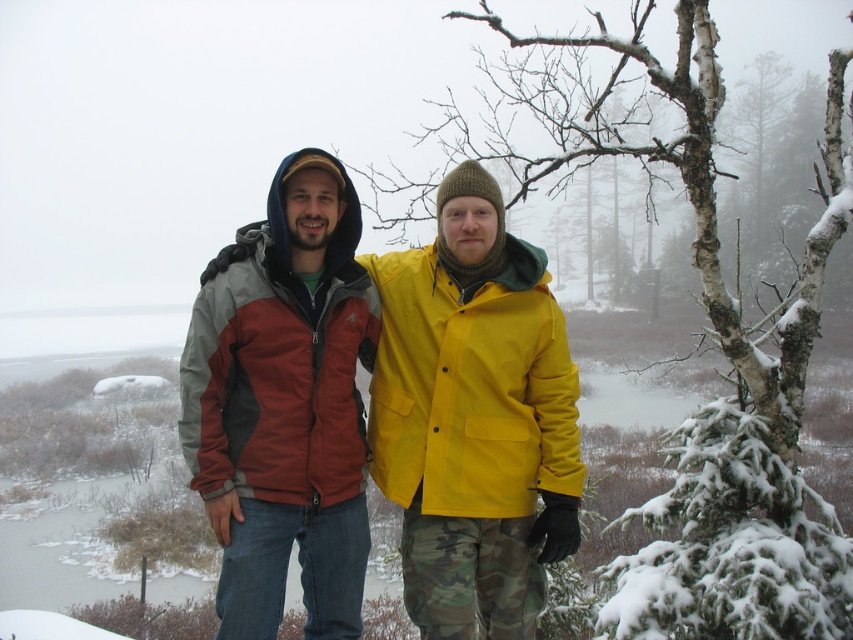
Question: Can you confirm if matte red jacket at center is positioned above matte nylon jacket at center?

Choices:
 (A) yes
 (B) no

Answer: (B)

Question: Is matte red jacket at center behind matte nylon jacket at center?

Choices:
 (A) yes
 (B) no

Answer: (B)

Question: Does matte red jacket at center come behind matte nylon jacket at center?

Choices:
 (A) no
 (B) yes

Answer: (A)